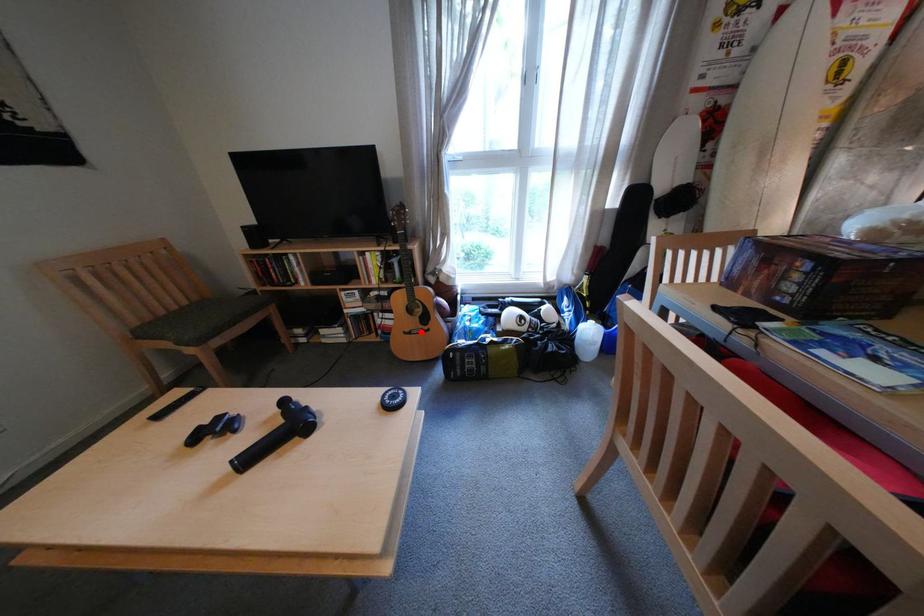
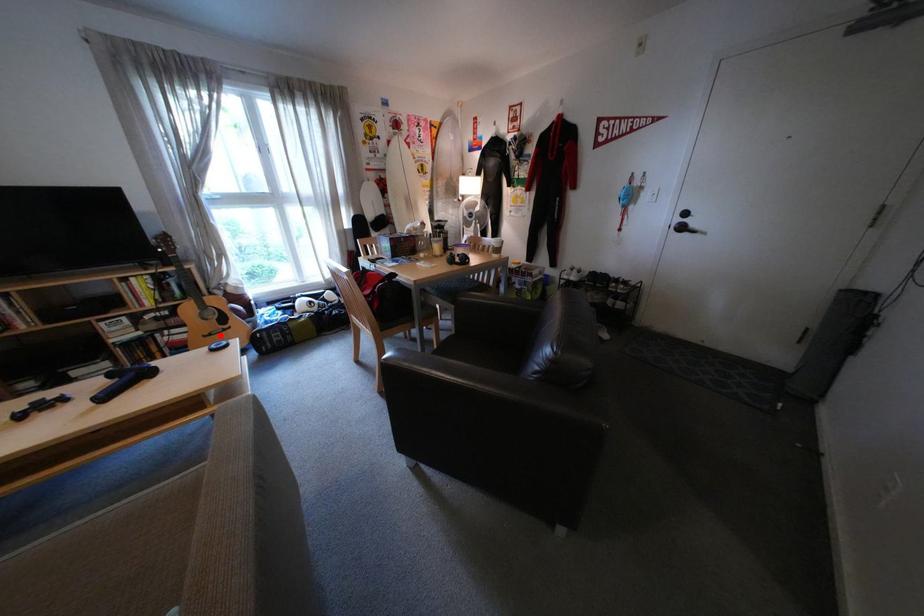
I am providing you with two images of the same scene from different viewpoints. A red point is marked on the first image and another point is marked on the second image. Does the point marked in image1 correspond to the same location as the one in image2?

Yes